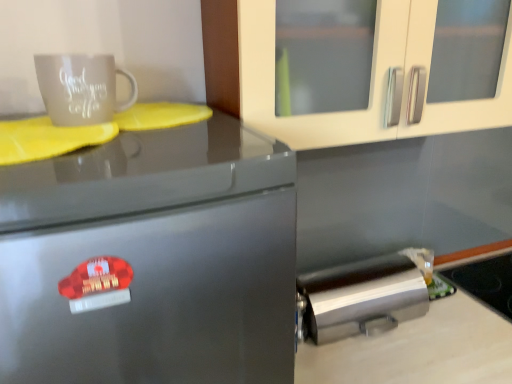
Question: From the image's perspective, is smooth white countertop at lower right positioned above or below brushed metal trash can at lower right?

Choices:
 (A) above
 (B) below

Answer: (B)

Question: Based on their positions, is smooth white countertop at lower right located to the left or right of brushed metal trash can at lower right?

Choices:
 (A) right
 (B) left

Answer: (A)

Question: Estimate the real-world distances between objects in this image. Which object is farther from the glassy black stove at lower right?

Choices:
 (A) brushed metal trash can at lower right
 (B) smooth white countertop at lower right
 (C) matte ceramic mug at upper left
 (D) satin silver fridge at left

Answer: (C)

Question: Estimate the real-world distances between objects in this image. Which object is farther from the smooth white countertop at lower right?

Choices:
 (A) satin silver fridge at left
 (B) glassy black stove at lower right
 (C) brushed metal trash can at lower right
 (D) matte ceramic mug at upper left

Answer: (D)